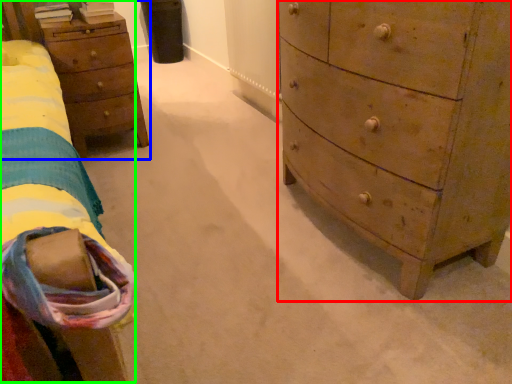
Question: Estimate the real-world distances between objects in this image. Which object is closer to chest of drawers (highlighted by a red box), nightstand (highlighted by a blue box) or bed (highlighted by a green box)?

Choices:
 (A) nightstand
 (B) bed

Answer: (B)